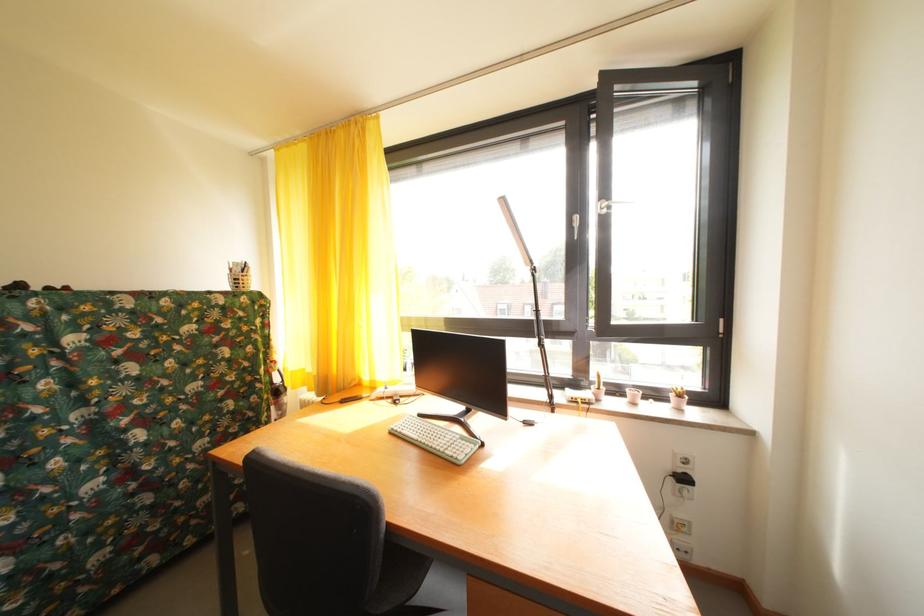
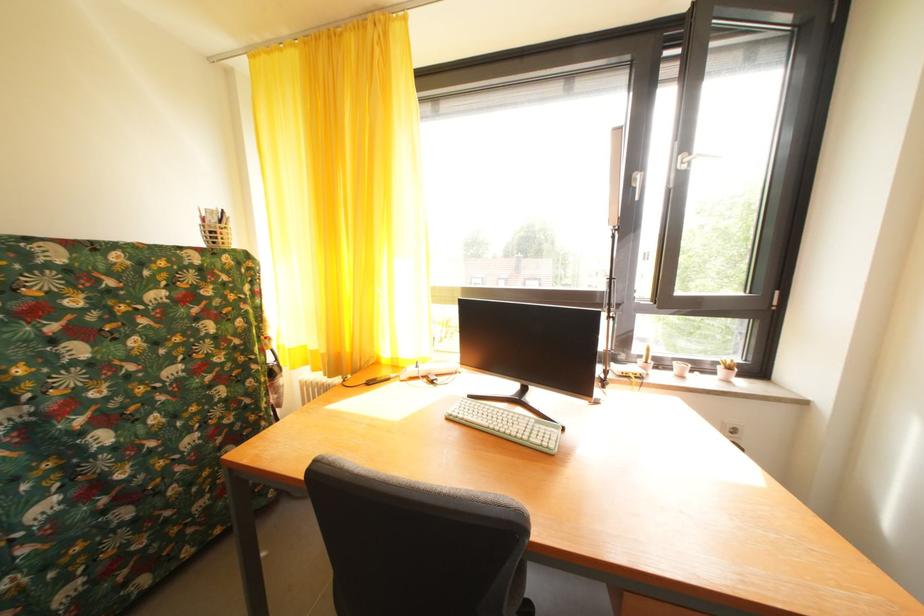
Find the pixel in the second image that matches point (681, 400) in the first image.

(728, 374)